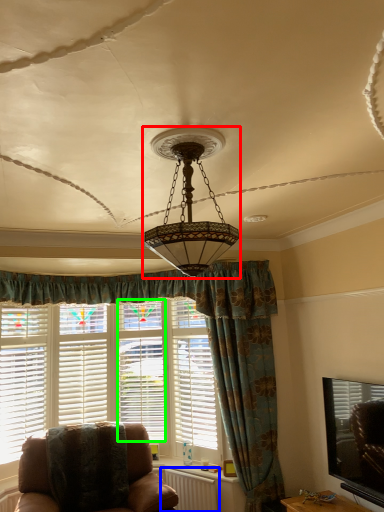
Question: Which object is the closest to the lamp (highlighted by a red box)? Choose among these: radiator (highlighted by a blue box) or shutter (highlighted by a green box).

Choices:
 (A) radiator
 (B) shutter

Answer: (B)